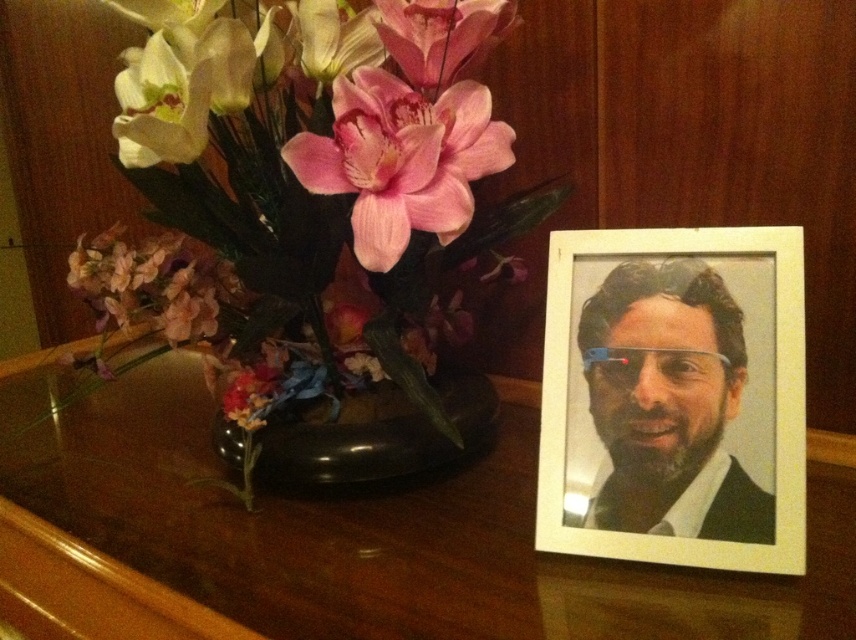
From the picture: Can you confirm if glossy wood table at center is positioned to the right of pink matte flower at left?

Indeed, glossy wood table at center is positioned on the right side of pink matte flower at left.

Looking at this image, does glossy wood table at center have a lesser width compared to pink matte flower at left?

No, glossy wood table at center is not thinner than pink matte flower at left.

Where is `glossy wood table at center`? glossy wood table at center is located at coordinates (343, 541).

This screenshot has height=640, width=856. Identify the location of glossy wood table at center. (343, 541).

Can you confirm if white wood picture frame at right is bigger than pink silky flower at upper center?

Correct, white wood picture frame at right is larger in size than pink silky flower at upper center.

At what (x,y) coordinates should I click in order to perform the action: click on white wood picture frame at right. Please return your answer as a coordinate pair (x, y). This screenshot has height=640, width=856. Looking at the image, I should click on (675, 397).

Is point (401, 54) farther from viewer compared to point (232, 310)?

No, it is not.

Does point (328, 280) come in front of point (198, 282)?

Yes, it is in front of point (198, 282).

Identify the location of silky artificial flowers at left. Image resolution: width=856 pixels, height=640 pixels. (330, 196).

Find the location of a particular element. The width and height of the screenshot is (856, 640). silky artificial flowers at left is located at coordinates (330, 196).